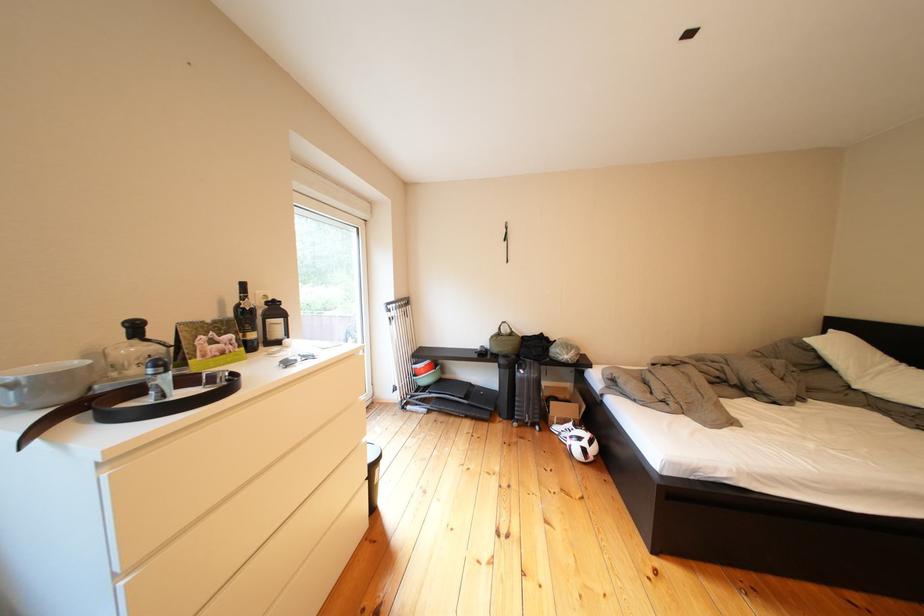
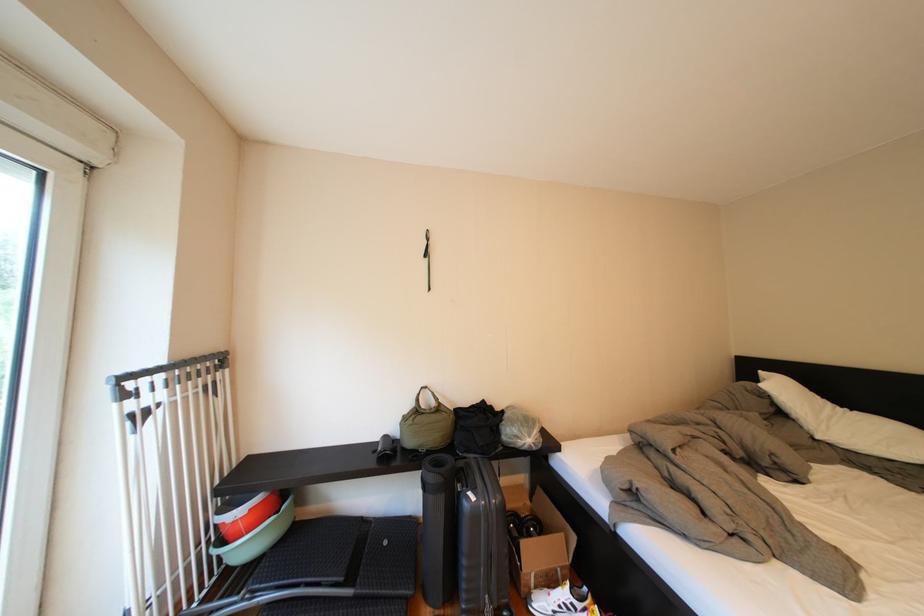
Find the pixel in the second image that matches point (570, 432) in the first image.

(554, 609)